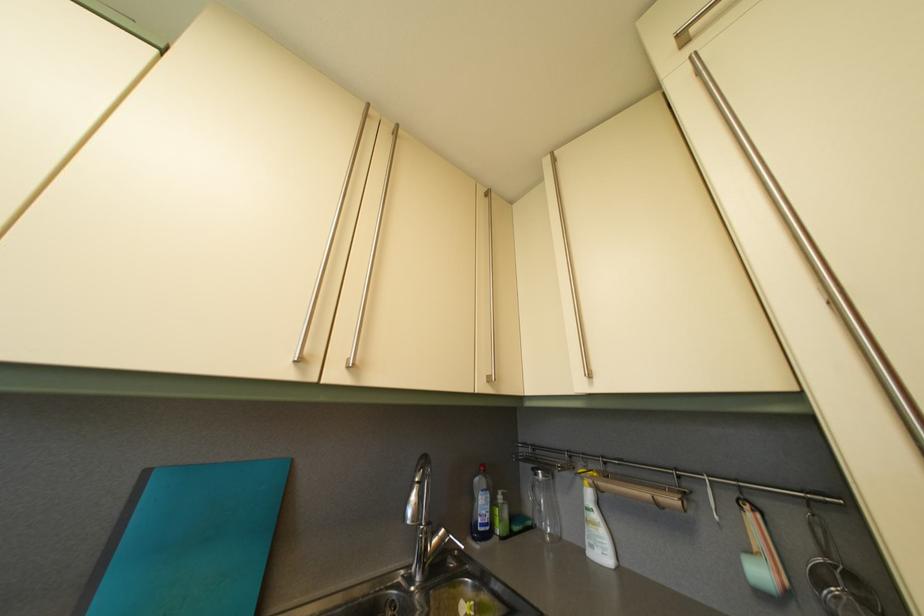
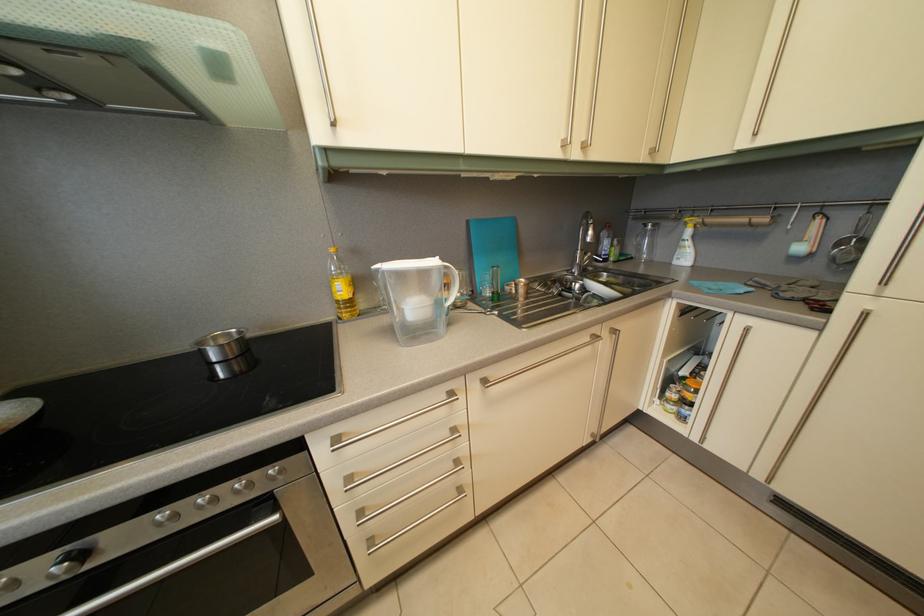
Locate, in the second image, the point that corresponds to pixel 590 485 in the first image.

(694, 232)